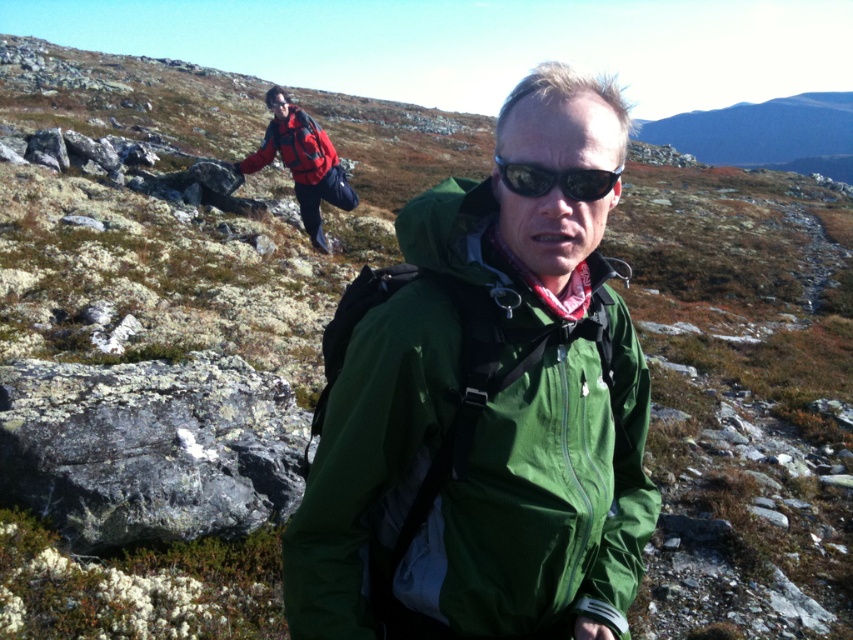
Is green fabric jacket at center closer to camera compared to matte red jacket at upper left?

Yes, it is in front of matte red jacket at upper left.

Between green fabric jacket at center and matte red jacket at upper left, which one is positioned lower?

green fabric jacket at center is lower down.

Does point (433, 499) come closer to viewer compared to point (326, 195)?

Yes, it is in front of point (326, 195).

Image resolution: width=853 pixels, height=640 pixels. I want to click on green fabric jacket at center, so click(x=477, y=442).

Who is positioned more to the right, red fleece jacket at upper left or sunglasses at center?

sunglasses at center

Is red fleece jacket at upper left closer to the viewer compared to sunglasses at center?

No, red fleece jacket at upper left is further to the viewer.

Where is `red fleece jacket at upper left`? red fleece jacket at upper left is located at coordinates (294, 147).

Is green fabric jacket at center bigger than red fleece jacket at upper left?

Incorrect, green fabric jacket at center is not larger than red fleece jacket at upper left.

Is green fabric jacket at center taller than red fleece jacket at upper left?

Incorrect, green fabric jacket at center's height is not larger of red fleece jacket at upper left's.

This screenshot has width=853, height=640. What do you see at coordinates (477, 442) in the screenshot?
I see `green fabric jacket at center` at bounding box center [477, 442].

Locate an element on the screen. green fabric jacket at center is located at coordinates (477, 442).